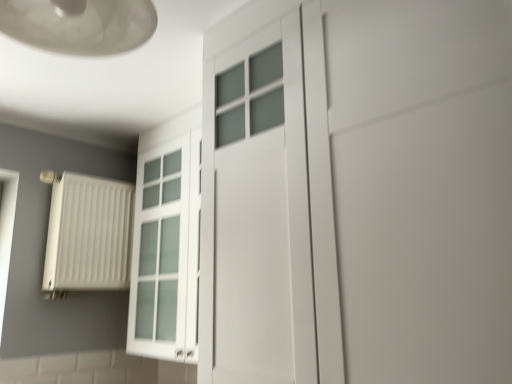
Question: Is white matte door at center thinner than white matte radiator at left?

Choices:
 (A) yes
 (B) no

Answer: (B)

Question: Would you say white matte radiator at left is part of white matte door at center's contents?

Choices:
 (A) no
 (B) yes

Answer: (A)

Question: From a real-world perspective, does white matte door at center sit lower than white matte radiator at left?

Choices:
 (A) no
 (B) yes

Answer: (A)

Question: Is white matte door at center taller than white matte radiator at left?

Choices:
 (A) yes
 (B) no

Answer: (A)

Question: Is white matte door at center facing away from white matte radiator at left?

Choices:
 (A) no
 (B) yes

Answer: (A)

Question: Is white matte door at center far from white matte radiator at left?

Choices:
 (A) no
 (B) yes

Answer: (B)

Question: Is white matte door at center closer to camera compared to matte glass lampshade at upper left?

Choices:
 (A) no
 (B) yes

Answer: (A)

Question: Considering the relative sizes of white matte door at center and matte glass lampshade at upper left in the image provided, is white matte door at center shorter than matte glass lampshade at upper left?

Choices:
 (A) yes
 (B) no

Answer: (B)

Question: From the image's perspective, would you say white matte door at center is positioned over matte glass lampshade at upper left?

Choices:
 (A) no
 (B) yes

Answer: (A)

Question: Is white matte door at center positioned far away from matte glass lampshade at upper left?

Choices:
 (A) yes
 (B) no

Answer: (B)

Question: From a real-world perspective, is white matte door at center over matte glass lampshade at upper left?

Choices:
 (A) yes
 (B) no

Answer: (B)

Question: Is white matte door at center positioned with its back to matte glass lampshade at upper left?

Choices:
 (A) no
 (B) yes

Answer: (A)

Question: Is matte glass lampshade at upper left beside white matte door at center?

Choices:
 (A) yes
 (B) no

Answer: (B)